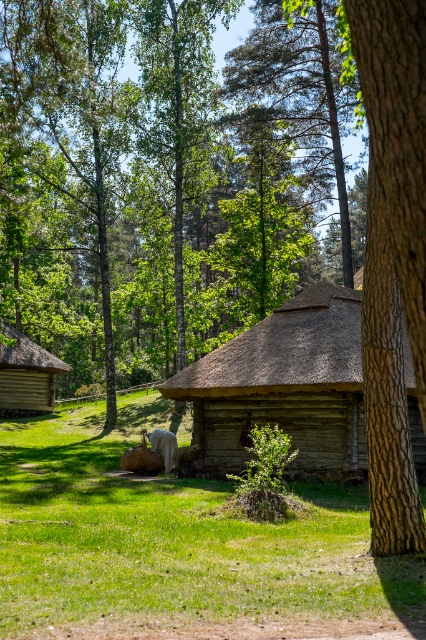
You are standing in the rural scene and want to place a small flag at the point closer to you between point (209, 442) and point (11, 413). Which point should you choose?

Point (209, 442) is closer to the camera than point (11, 413), so you should choose point (209, 442) to place the flag.

You are a gardener planning to plant flowers in the green grass at center. Considering the size of the wooden log cabin at center, will there be enough space to plant a row of flowers around the cabin without encroaching on the cabin itself?

The green grass at center is bigger than the wooden log cabin at center, so there should be enough space to plant a row of flowers around the cabin without encroaching on it.